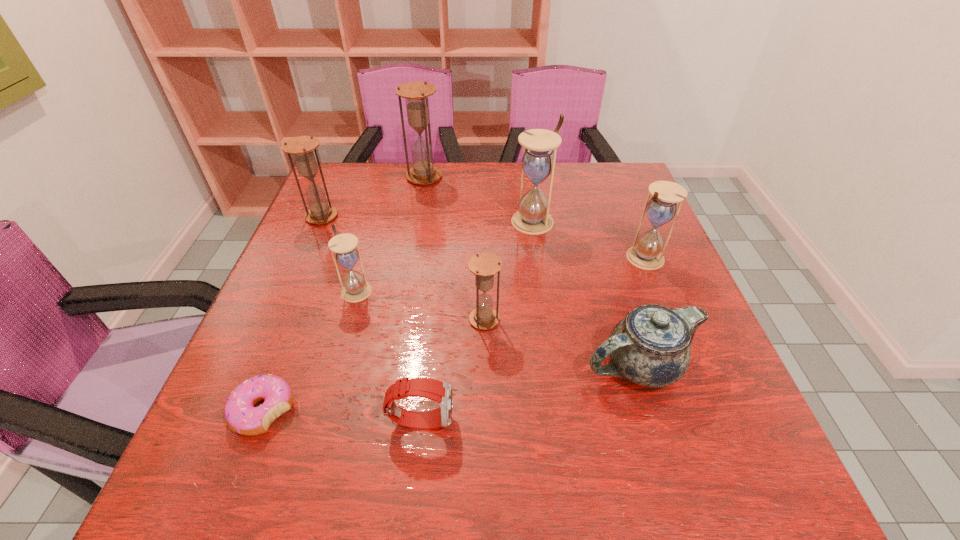
What are the coordinates of `unoccupied position between the nearest hourglass and the shortest object` in the screenshot? It's located at (374, 365).

This screenshot has width=960, height=540. What are the coordinates of `vacant point located between the rightmost brown hourglass and the second biggest brown hourglass` in the screenshot? It's located at (403, 268).

This screenshot has height=540, width=960. What are the coordinates of `unoccupied position between the second biggest brown hourglass and the fourth nearest object` in the screenshot? It's located at (403, 268).

This screenshot has width=960, height=540. What are the coordinates of `empty space that is in between the leftmost brown hourglass and the sixth nearest object` in the screenshot? It's located at (484, 237).

Find the location of a particular element. Image resolution: width=960 pixels, height=540 pixels. vacant area that lies between the fourth farthest object and the leftmost hourglass is located at coordinates point(484,237).

You are a GUI agent. You are given a task and a screenshot of the screen. Output one action in this format:
    pyautogui.click(x=<x>, y=<y>)
    Task: Click on the unoccupied area between the shortest object and the second white hourglass from left to right
    Image resolution: width=960 pixels, height=540 pixels.
    Given the screenshot: What is the action you would take?
    pyautogui.click(x=398, y=316)

Select which object is the sixth closest to the chinaware. Please provide its 2D coordinates. Your answer should be formatted as a tuple, i.e. [(x, y)], where the tuple contains the x and y coordinates of a point satisfying the conditions above.

[(241, 415)]

You are a GUI agent. You are given a task and a screenshot of the screen. Output one action in this format:
    pyautogui.click(x=<x>, y=<y>)
    Task: Click on the second closest object relative to the biggest white hourglass
    The width and height of the screenshot is (960, 540).
    Given the screenshot: What is the action you would take?
    pyautogui.click(x=416, y=94)

This screenshot has width=960, height=540. I want to click on hourglass that is the second closest one to the farthest object, so click(538, 162).

Choose which hourglass is the nearest neighbor to the third nearest hourglass. Please provide its 2D coordinates. Your answer should be formatted as a tuple, i.e. [(x, y)], where the tuple contains the x and y coordinates of a point satisfying the conditions above.

[(538, 162)]